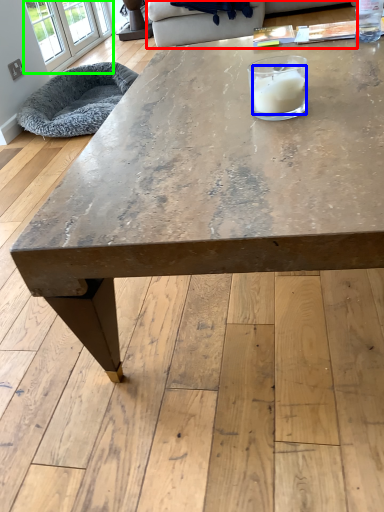
Question: Which object is the farthest from couch (highlighted by a red box)? Choose among these: candle (highlighted by a blue box) or window (highlighted by a green box).

Choices:
 (A) candle
 (B) window

Answer: (A)